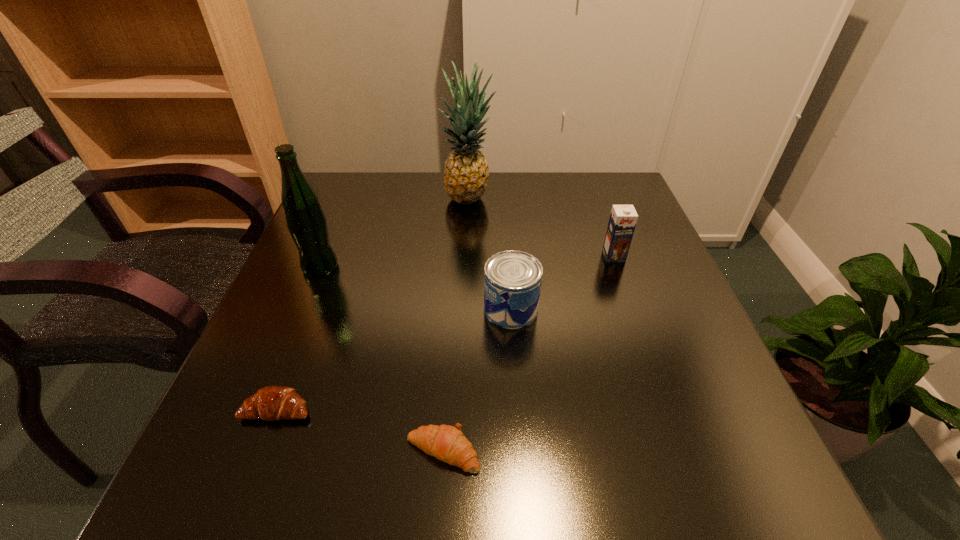
Identify the location of object that is at the near edge. The height and width of the screenshot is (540, 960). (447, 443).

In order to click on beer bottle present at the left edge in this screenshot , I will do `click(306, 222)`.

Image resolution: width=960 pixels, height=540 pixels. Find the location of `crescent roll at the left edge`. crescent roll at the left edge is located at coordinates (272, 403).

Locate an element on the screen. object present at the right edge is located at coordinates (623, 218).

In the image, there is a desktop. What are the coordinates of `vacant space at the far edge` in the screenshot? It's located at (503, 205).

I want to click on free region at the near edge, so click(x=614, y=467).

Find the location of a particular element. This screenshot has height=540, width=960. vacant space at the left edge is located at coordinates (287, 326).

I want to click on free space at the right edge, so click(x=677, y=303).

This screenshot has width=960, height=540. I want to click on vacant space at the far left corner of the desktop, so click(x=344, y=200).

The image size is (960, 540). Identify the location of free point at the far right corner. (595, 208).